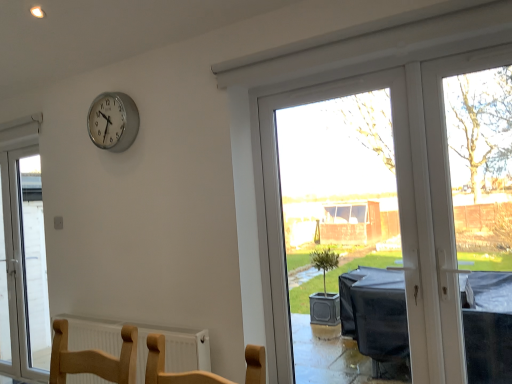
Question: Relative to white glass door at left, arranged as the 1th window when viewed from the left, is white textured radiator at lower center in front or behind?

Choices:
 (A) front
 (B) behind

Answer: (A)

Question: Looking at the image, does white textured radiator at lower center seem bigger or smaller compared to white glass door at left, the second window from the right?

Choices:
 (A) big
 (B) small

Answer: (B)

Question: Considering the real-world distances, which object is closest to the silver metallic clock at upper left?

Choices:
 (A) white glass door at left, arranged as the 1th window when viewed from the left
 (B) transparent plastic window at center, acting as the 1th window starting from the right
 (C) white textured radiator at lower center

Answer: (C)

Question: Which is farther from the white textured radiator at lower center?

Choices:
 (A) transparent plastic window at center, acting as the 1th window starting from the right
 (B) silver metallic clock at upper left
 (C) white glass door at left, which is counted as the first window, starting from the back

Answer: (A)